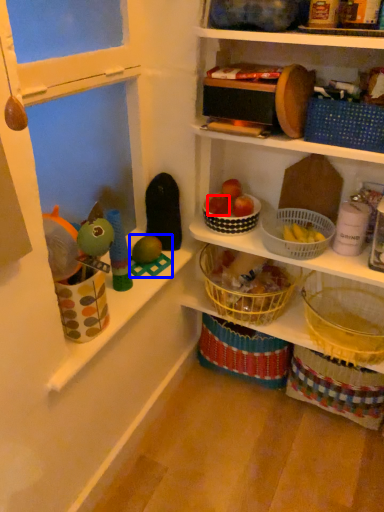
Question: Among these objects, which one is nearest to the camera, apple (highlighted by a red box) or toy (highlighted by a blue box)?

Choices:
 (A) apple
 (B) toy

Answer: (B)